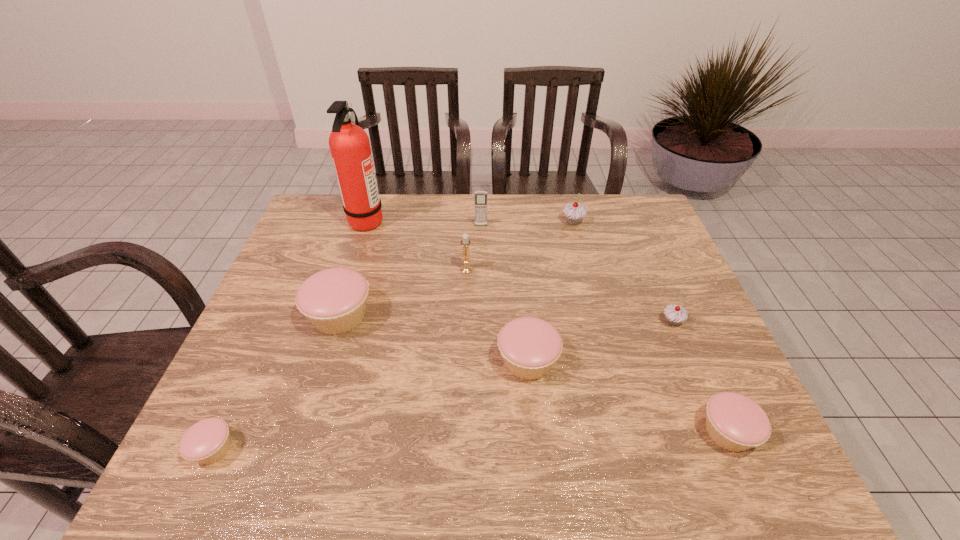
This screenshot has height=540, width=960. I want to click on vacant space located 0.300m on the front of the fourth farthest object, so click(464, 357).

The width and height of the screenshot is (960, 540). Find the location of `blank area located on the left of the fourth cupcake from left to right`. blank area located on the left of the fourth cupcake from left to right is located at coordinates (540, 222).

At what (x,y) coordinates should I click in order to perform the action: click on vacant region located 0.190m on the back of the fifth cupcake from right to left. Please return your answer as a coordinate pair (x, y). Looking at the image, I should click on (361, 248).

Where is `vacant position located on the left of the sixth object from left to right`? vacant position located on the left of the sixth object from left to right is located at coordinates (342, 361).

Where is `free space located on the back of the nearer gray cupcake`? free space located on the back of the nearer gray cupcake is located at coordinates (657, 284).

Find the location of a particular element. This screenshot has height=540, width=960. vacant space located 0.180m on the back of the fifth tallest cupcake is located at coordinates (688, 342).

Where is `vacant space positioned on the back of the shortest cupcake`? This screenshot has height=540, width=960. vacant space positioned on the back of the shortest cupcake is located at coordinates (248, 373).

The height and width of the screenshot is (540, 960). Find the location of `fire extinguisher that is positioned at the far edge`. fire extinguisher that is positioned at the far edge is located at coordinates (349, 144).

Identify the location of cellular telephone situated at the far edge. This screenshot has width=960, height=540. (480, 196).

The image size is (960, 540). Identify the location of cupcake present at the far edge. (574, 213).